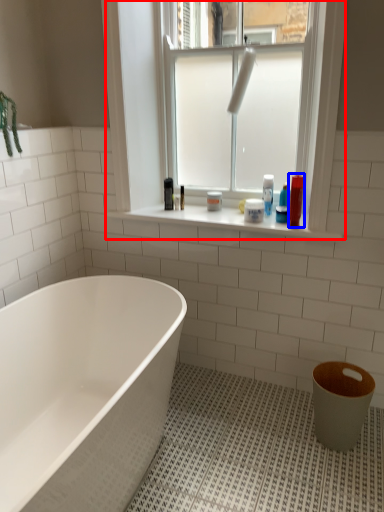
Question: Which object appears closest to the camera in this image, window (highlighted by a red box) or toiletry (highlighted by a blue box)?

Choices:
 (A) window
 (B) toiletry

Answer: (A)